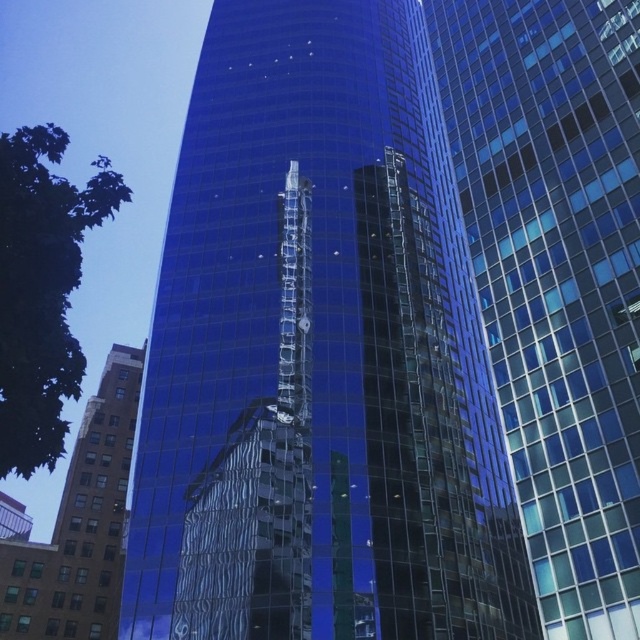
Question: Does glossy glass building at center have a greater width compared to brown brick building at lower left?

Choices:
 (A) yes
 (B) no

Answer: (B)

Question: Based on their relative distances, which object is farther from the glossy glass building at center?

Choices:
 (A) transparent glass building at center
 (B) brown brick building at lower left

Answer: (B)

Question: Estimate the real-world distances between objects in this image. Which object is closer to the brown brick building at lower left?

Choices:
 (A) glossy glass building at center
 (B) transparent glass building at center

Answer: (A)

Question: Can you confirm if glossy glass building at center is wider than brown brick building at lower left?

Choices:
 (A) yes
 (B) no

Answer: (B)

Question: Does glossy glass building at center appear on the right side of brown brick building at lower left?

Choices:
 (A) no
 (B) yes

Answer: (B)

Question: Which object is positioned closest to the glossy glass building at center?

Choices:
 (A) transparent glass building at center
 (B) brown brick building at lower left

Answer: (A)